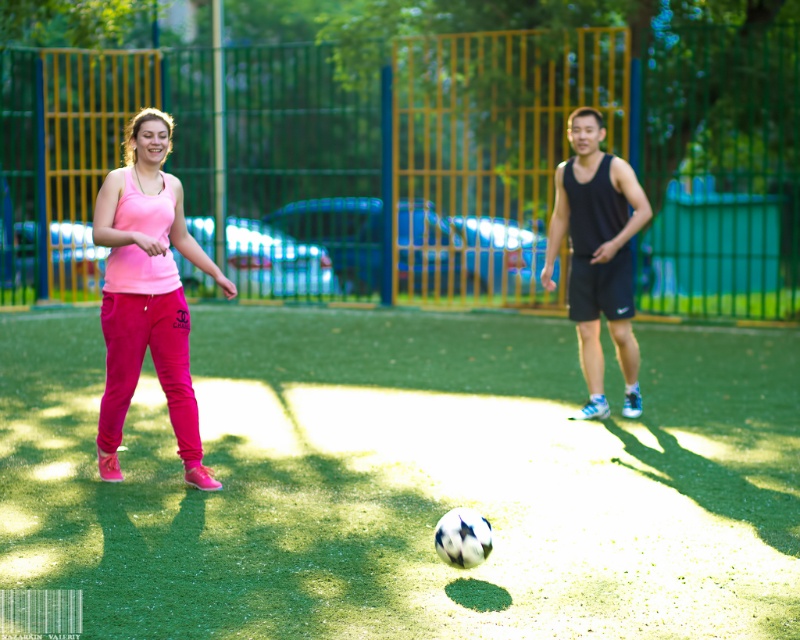
Is green artificial turf at center below pink fabric pants at left?

Yes, green artificial turf at center is below pink fabric pants at left.

In order to click on green artificial turf at center in this screenshot , I will do `click(408, 480)`.

What do you see at coordinates (408, 480) in the screenshot? I see `green artificial turf at center` at bounding box center [408, 480].

Locate an element on the screen. The width and height of the screenshot is (800, 640). green artificial turf at center is located at coordinates pyautogui.click(x=408, y=480).